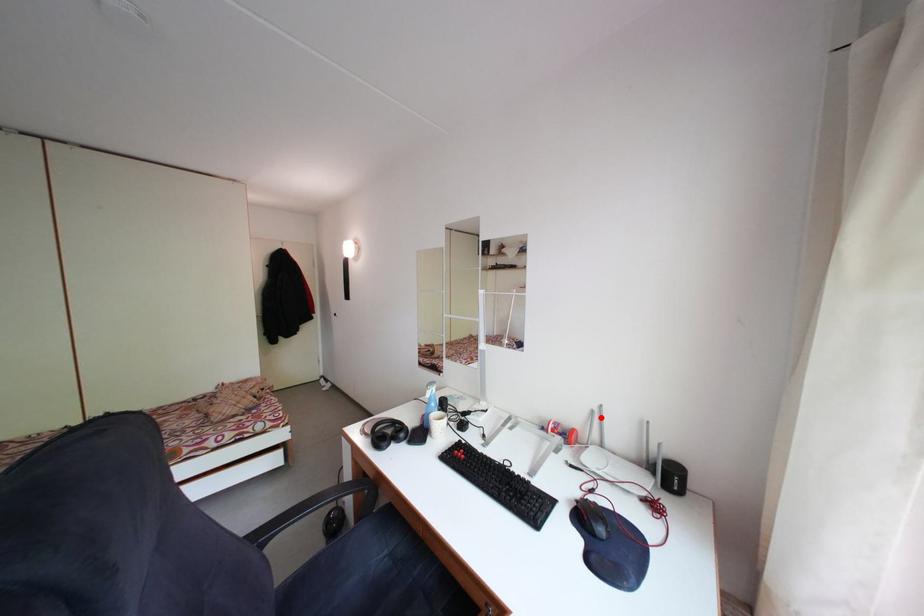
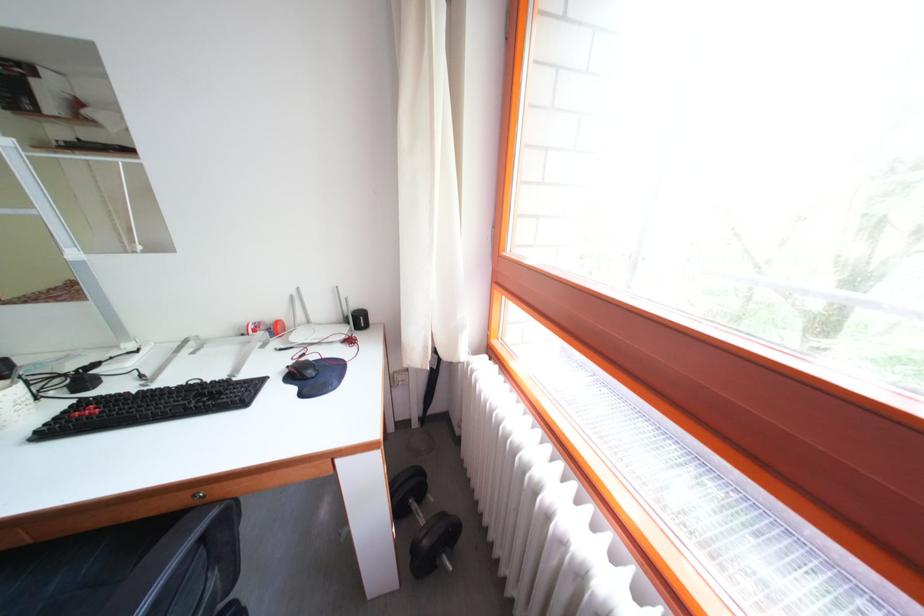
Where in the second image is the point corresponding to the highlighted location from the first image?

(300, 302)